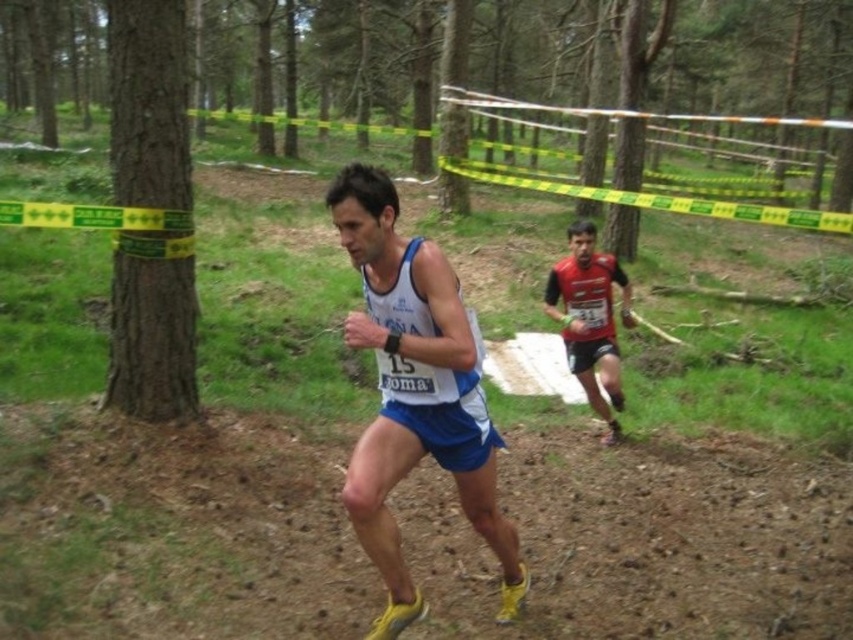
You are a photographer positioned at the starting line of the cross country race. You want to take a photo that includes both runners. The first runner is at point (111, 522) and the second runner is at point (352, 524). Which runner is closer to your camera?

The first runner at point (111, 522) is closer to the camera because the point is further to the camera than the second point.